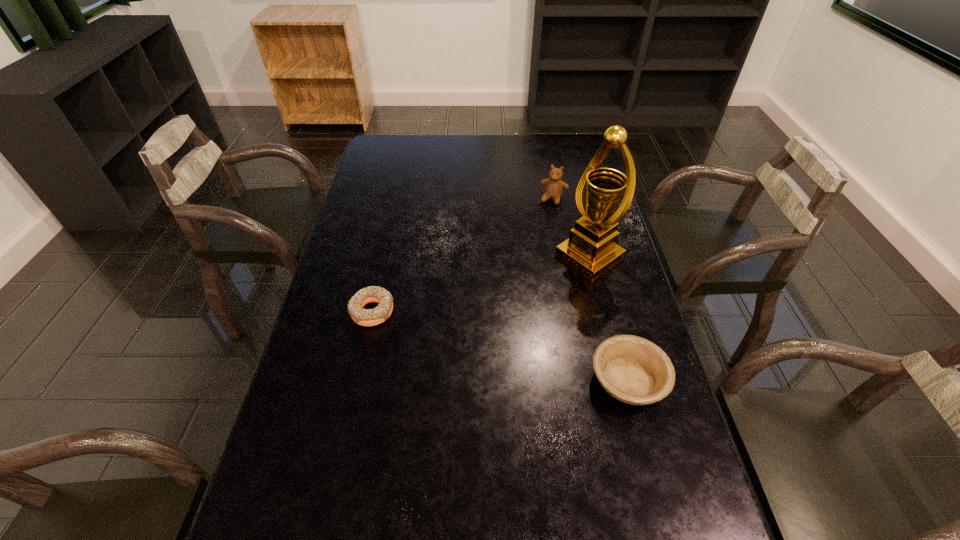
At what (x,y) coordinates should I click in order to perform the action: click on vacant space positioned on the front-facing side of the teddy bear. Please return your answer as a coordinate pair (x, y). Looking at the image, I should click on (545, 219).

In order to click on vacant space located 0.230m on the front-facing side of the teddy bear in this screenshot , I will do `click(534, 246)`.

Locate an element on the screen. The width and height of the screenshot is (960, 540). free location located on the front-facing side of the teddy bear is located at coordinates (545, 219).

Locate an element on the screen. The width and height of the screenshot is (960, 540). vacant space positioned on the front-facing side of the second farthest object is located at coordinates (470, 338).

Where is `free space located on the front-facing side of the second farthest object`? The width and height of the screenshot is (960, 540). free space located on the front-facing side of the second farthest object is located at coordinates (555, 280).

Where is `blank space located 0.180m on the front-facing side of the second farthest object`? The height and width of the screenshot is (540, 960). blank space located 0.180m on the front-facing side of the second farthest object is located at coordinates (524, 301).

Locate an element on the screen. object that is at the left edge is located at coordinates (365, 317).

I want to click on bowl positioned at the right edge, so click(x=634, y=370).

Identify the location of teddy bear that is at the right edge. (554, 186).

I want to click on award that is at the right edge, so click(591, 248).